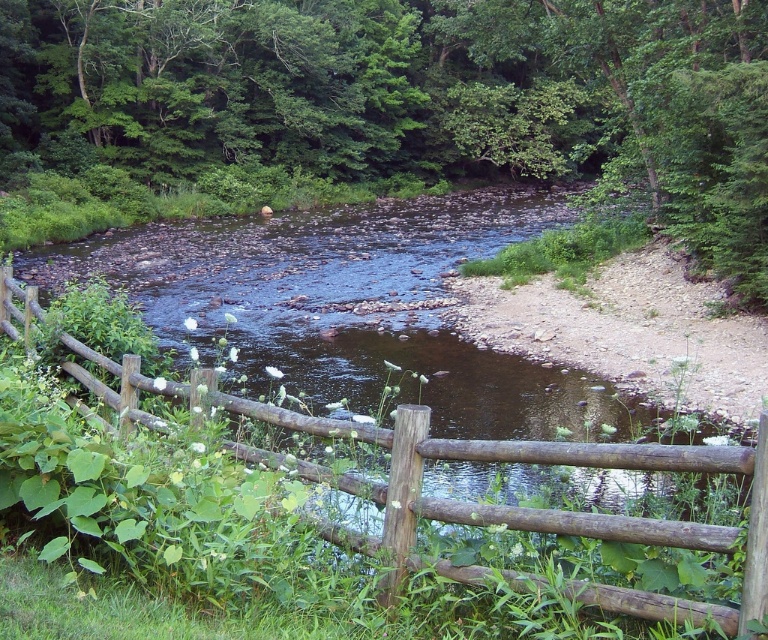
Can you confirm if green leafy tree at center is smaller than brown wooden fence at center?

No, green leafy tree at center is not smaller than brown wooden fence at center.

Locate an element on the screen. The width and height of the screenshot is (768, 640). green leafy tree at center is located at coordinates (414, 97).

Where is `green leafy tree at center`? The width and height of the screenshot is (768, 640). green leafy tree at center is located at coordinates (414, 97).